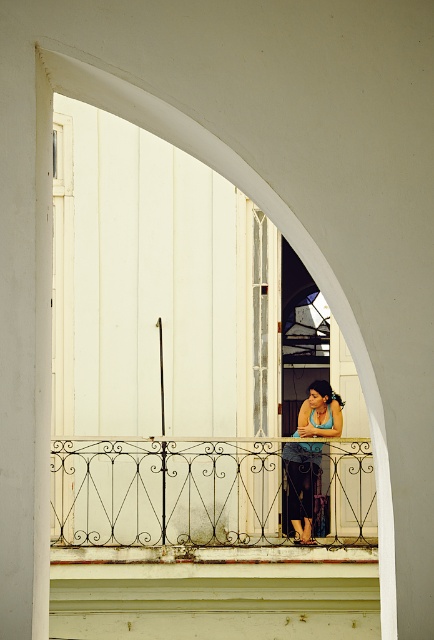
Question: Is white wrought iron balustrade at center further to the viewer compared to white matte archway at center?

Choices:
 (A) no
 (B) yes

Answer: (B)

Question: Considering the relative positions of white wrought iron balustrade at center and white matte archway at center in the image provided, where is white wrought iron balustrade at center located with respect to white matte archway at center?

Choices:
 (A) left
 (B) right

Answer: (A)

Question: Which of these objects is positioned closest to the white wrought iron balustrade at center?

Choices:
 (A) white matte archway at center
 (B) blue fabric tank top at center

Answer: (B)

Question: Does white matte archway at center appear on the right side of blue fabric tank top at center?

Choices:
 (A) yes
 (B) no

Answer: (B)

Question: Which of the following is the closest to the observer?

Choices:
 (A) (305, 236)
 (B) (311, 493)

Answer: (A)

Question: Which point is closer to the camera?

Choices:
 (A) (315, 481)
 (B) (371, 422)

Answer: (B)